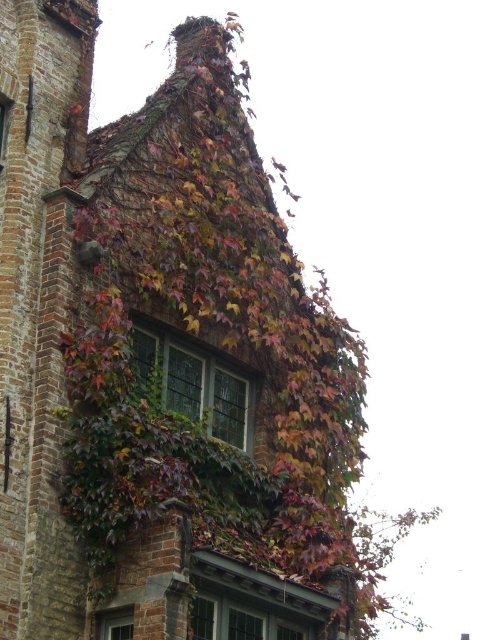
Question: Can you confirm if stained glass window at center is bigger than clear glass window at lower left?

Choices:
 (A) no
 (B) yes

Answer: (B)

Question: Is stained glass window at center thinner than clear glass window at lower left?

Choices:
 (A) no
 (B) yes

Answer: (A)

Question: Which point appears farthest from the camera in this image?

Choices:
 (A) (124, 625)
 (B) (164, 368)

Answer: (B)

Question: From the image, what is the correct spatial relationship of stained glass window at center in relation to clear glass window at lower left?

Choices:
 (A) right
 (B) left

Answer: (A)

Question: Among these objects, which one is farthest from the camera?

Choices:
 (A) clear glass window at lower left
 (B) stained glass window at center

Answer: (B)